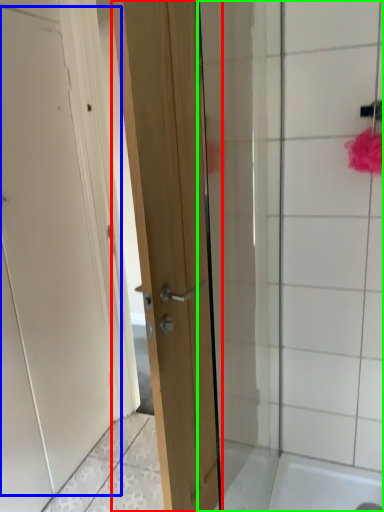
Question: Which object is positioned closest to door (highlighted by a red box)? Select from door (highlighted by a blue box) and shower door (highlighted by a green box).

Choices:
 (A) door
 (B) shower door

Answer: (B)